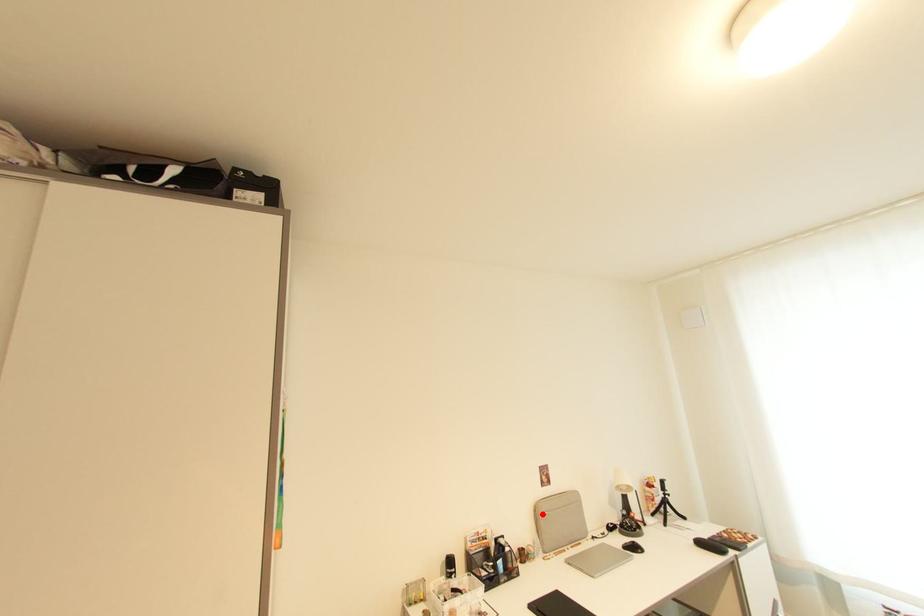
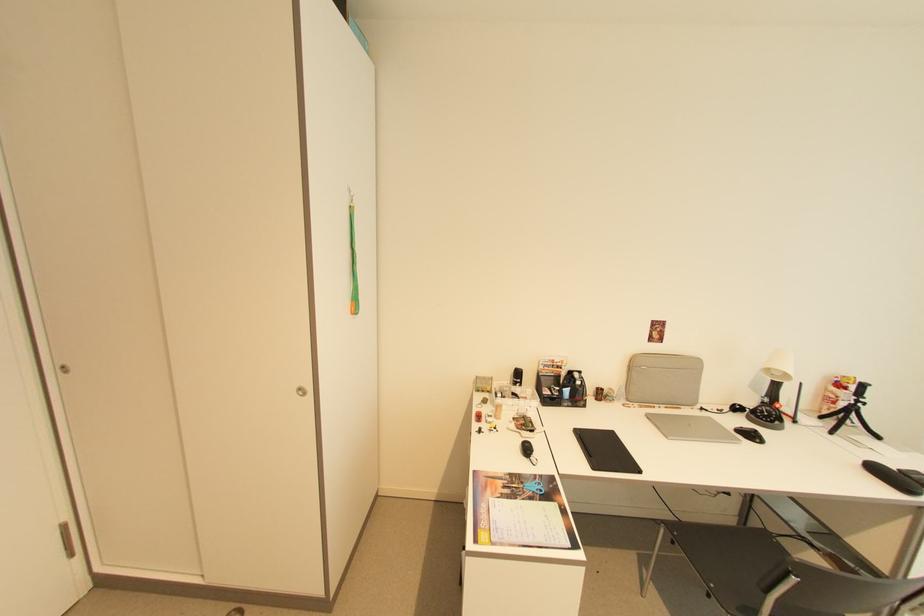
Question: A red point is marked in image1. In image2, is the corresponding 3D point closer to the camera or farther? Reply with the corresponding letter.

Choices:
 (A) The corresponding 3D point is closer.
 (B) The corresponding 3D point is farther.

Answer: (A)